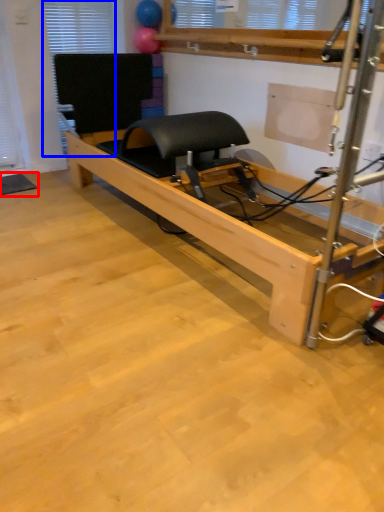
Question: Which of the following is the farthest to the observer, yoga mat (highlighted by a red box) or window (highlighted by a blue box)?

Choices:
 (A) yoga mat
 (B) window

Answer: (B)